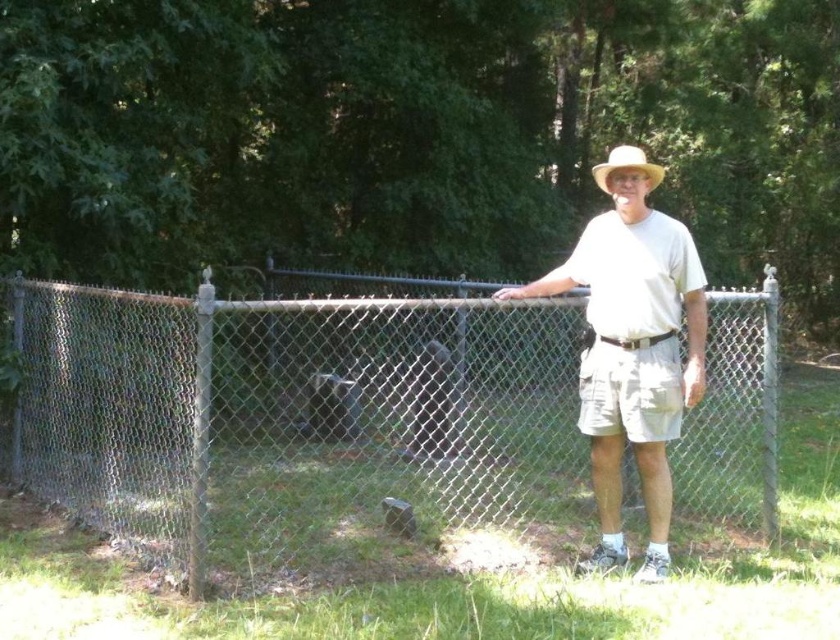
Consider the image. Which of these two, silver chain-link fence at center or light brown straw hat at center, stands taller?

light brown straw hat at center

Locate an element on the screen. silver chain-link fence at center is located at coordinates click(x=294, y=420).

Is point (418, 422) positioned behind point (623, 152)?

Yes.

Where is `silver chain-link fence at center`? Image resolution: width=840 pixels, height=640 pixels. silver chain-link fence at center is located at coordinates (294, 420).

Which of these two, white cotton shirt at center or light brown straw hat at center, stands taller?

With more height is light brown straw hat at center.

Between white cotton shirt at center and light brown straw hat at center, which one is positioned lower?

white cotton shirt at center

Find the location of a particular element. white cotton shirt at center is located at coordinates [633, 355].

What do you see at coordinates (294, 420) in the screenshot?
I see `silver chain-link fence at center` at bounding box center [294, 420].

Who is lower down, silver chain-link fence at center or white cotton shirt at center?

Positioned lower is silver chain-link fence at center.

Which is in front, point (210, 380) or point (609, 458)?

Point (210, 380) is in front.

This screenshot has width=840, height=640. Identify the location of silver chain-link fence at center. (x=294, y=420).